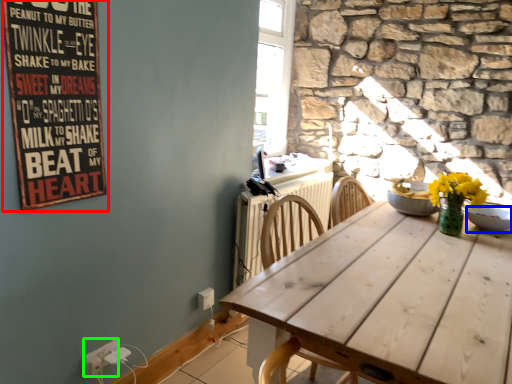
Question: Estimate the real-world distances between objects in this image. Which object is farther from bulletin board (highlighted by a red box), bowl (highlighted by a blue box) or electric outlet (highlighted by a green box)?

Choices:
 (A) bowl
 (B) electric outlet

Answer: (A)